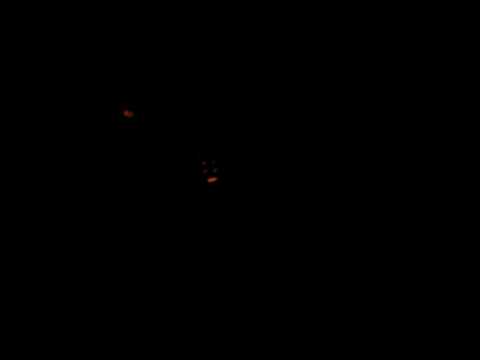
Where is `tiny light`? tiny light is located at coordinates (128, 112), (213, 179).